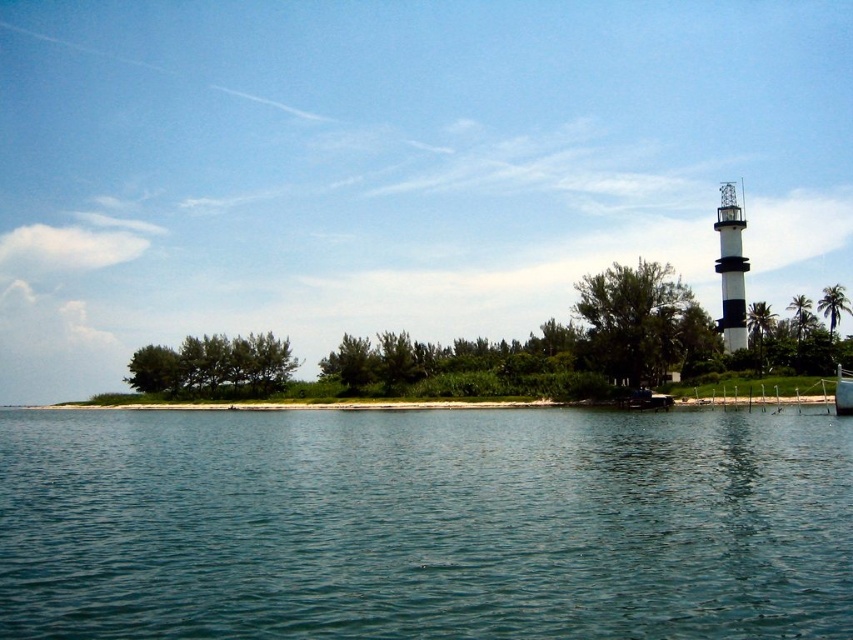
Question: Is green leafy tree at upper right positioned in front of green leafy palm tree at upper right?

Choices:
 (A) yes
 (B) no

Answer: (A)

Question: Which point is farther from the camera taking this photo?

Choices:
 (A) (532, 624)
 (B) (244, 364)
 (C) (801, 332)
 (D) (741, 218)

Answer: (D)

Question: Which of the following is the closest to the observer?

Choices:
 (A) green leafy bush at center
 (B) metallic silver boat at right
 (C) black and white striped tower at right

Answer: (B)

Question: Is black and white striped tower at right below green leafy tree at right?

Choices:
 (A) no
 (B) yes

Answer: (A)

Question: Estimate the real-world distances between objects in this image. Which object is farther from the green leafy bush at center?

Choices:
 (A) green leafy palm tree at upper right
 (B) clear blue water at center
 (C) green leafy tree at right
 (D) black and white striped tower at right

Answer: (A)

Question: Is black and white striped tower at right smaller than metallic silver boat at right?

Choices:
 (A) yes
 (B) no

Answer: (B)